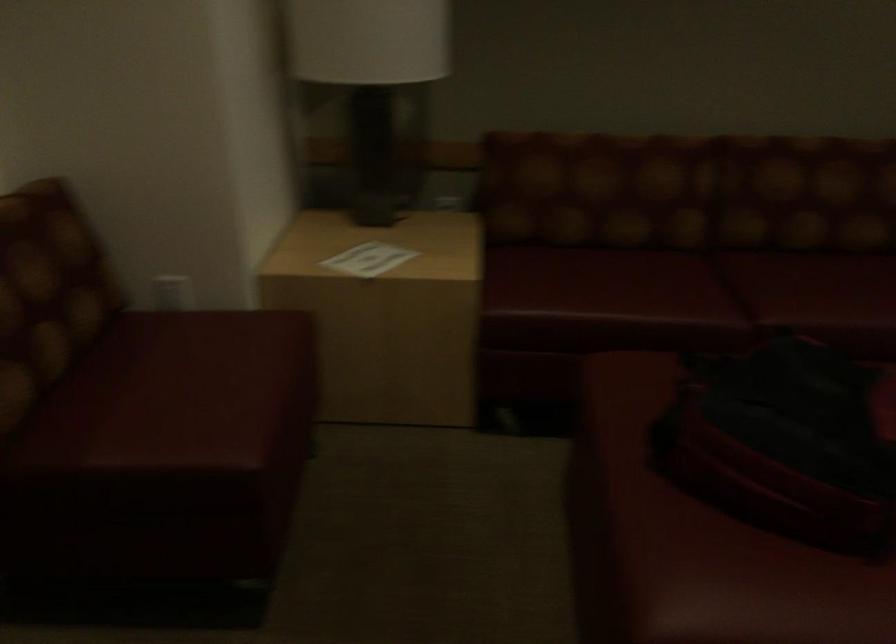
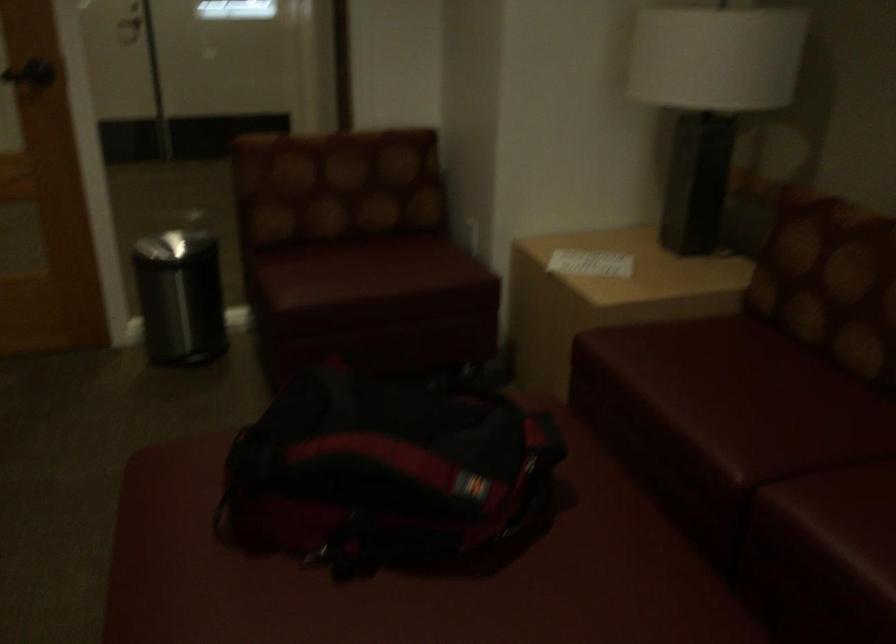
In the second image, find the point that corresponds to point (806, 308) in the first image.

(834, 522)